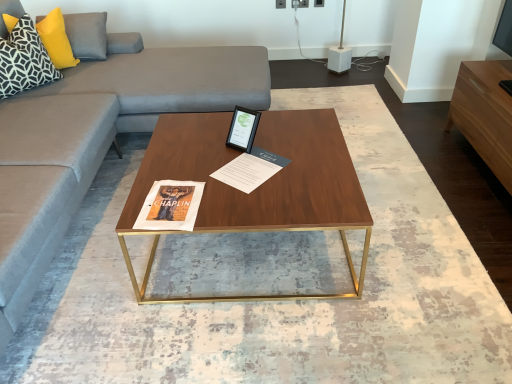
Identify the location of free space behind matte paper magazine at center. pyautogui.click(x=252, y=136).